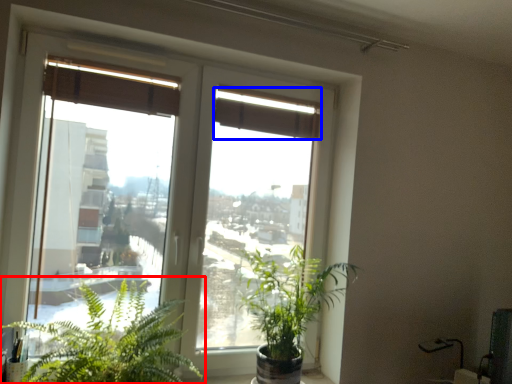
Question: Which object is further to the camera taking this photo, houseplant (highlighted by a red box) or curtain (highlighted by a blue box)?

Choices:
 (A) houseplant
 (B) curtain

Answer: (B)